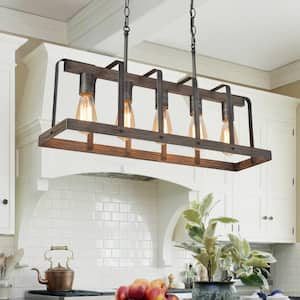
At what (x,y) coordinates should I click in order to perform the action: click on kettle. Please return your answer as a coordinate pair (x, y). The height and width of the screenshot is (300, 300). Looking at the image, I should click on (59, 272).